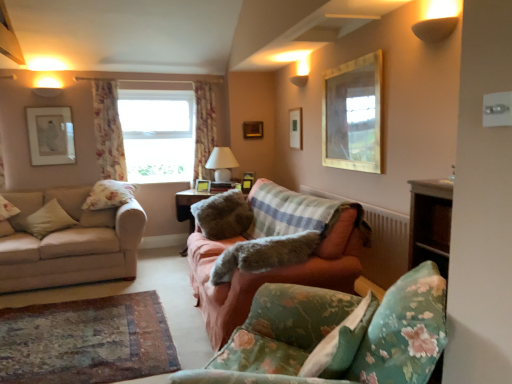
How much space does fluffy fabric pillow at center, placed as the second pillow when sorted from front to back, occupy vertically?

14.72 inches.

Where is `gold textured picture frame at upper right, which is the 6th picture frame from left to right`? Image resolution: width=512 pixels, height=384 pixels. gold textured picture frame at upper right, which is the 6th picture frame from left to right is located at coordinates (353, 115).

What do you see at coordinates (86, 341) in the screenshot? I see `rug at lower left` at bounding box center [86, 341].

Image resolution: width=512 pixels, height=384 pixels. What do you see at coordinates (51, 135) in the screenshot?
I see `matte white picture frame at upper left, which is the 6th picture frame from right to left` at bounding box center [51, 135].

Where is `beige fabric couch at left, placed as the third studio couch when sorted from right to left`? The height and width of the screenshot is (384, 512). beige fabric couch at left, placed as the third studio couch when sorted from right to left is located at coordinates (71, 243).

Is floral fabric curtain at center, which is the second curtain from front to back, smaller than gold textured picture frame at upper right, which appears as the 1th picture frame when viewed from the right?

No, floral fabric curtain at center, which is the second curtain from front to back, is not smaller than gold textured picture frame at upper right, which appears as the 1th picture frame when viewed from the right.

Based on their positions, is floral fabric curtain at center, which is counted as the first curtain, starting from the back, located to the left or right of gold textured picture frame at upper right, the 6th picture frame viewed from the back?

Based on their positions, floral fabric curtain at center, which is counted as the first curtain, starting from the back, is located to the left of gold textured picture frame at upper right, the 6th picture frame viewed from the back.

Is floral fabric curtain at center, which is the second curtain from front to back, oriented towards gold textured picture frame at upper right, which appears as the 1th picture frame when viewed from the right?

No, floral fabric curtain at center, which is the second curtain from front to back, is not aimed at gold textured picture frame at upper right, which appears as the 1th picture frame when viewed from the right.

Is floral fabric curtain at center, which is the second curtain from front to back, thinner than gold textured picture frame at upper right, which is the 6th picture frame from left to right?

No.

Would you say beige fabric couch at left, placed as the third studio couch when sorted from right to left, is inside or outside wooden picture frame at center, which appears as the 4th picture frame when viewed from the right?

beige fabric couch at left, placed as the third studio couch when sorted from right to left, exists outside the volume of wooden picture frame at center, which appears as the 4th picture frame when viewed from the right.

Looking at the image, does beige fabric couch at left, placed as the third studio couch when sorted from right to left, seem bigger or smaller compared to wooden picture frame at center, which ranks as the 4th picture frame in front-to-back order?

Considering their sizes, beige fabric couch at left, placed as the third studio couch when sorted from right to left, takes up more space than wooden picture frame at center, which ranks as the 4th picture frame in front-to-back order.

Which is more to the right, beige fabric couch at left, placed as the third studio couch when sorted from right to left, or wooden picture frame at center, which appears as the 4th picture frame when viewed from the right?

Positioned to the right is wooden picture frame at center, which appears as the 4th picture frame when viewed from the right.

Is beige fabric couch at left, placed as the third studio couch when sorted from right to left, positioned with its back to wooden picture frame at center, which is the 3th picture frame from left to right?

No, beige fabric couch at left, placed as the third studio couch when sorted from right to left, is not facing the opposite direction of wooden picture frame at center, which is the 3th picture frame from left to right.

Can you tell me how much white glossy table lamp at center and floral fabric pillow at lower right, which is the fourth pillow in back-to-front order, differ in facing direction?

96.6 degrees.

Considering the positions of points (218, 174) and (337, 343), is point (218, 174) farther from camera compared to point (337, 343)?

Yes, it is behind point (337, 343).

Is white glossy table lamp at center not within floral fabric pillow at lower right, which is the 4th pillow from left to right?

Yes, white glossy table lamp at center is outside of floral fabric pillow at lower right, which is the 4th pillow from left to right.

Is white glossy table lamp at center facing towards floral fabric pillow at lower right, which is the fourth pillow in back-to-front order?

No, white glossy table lamp at center does not turn towards floral fabric pillow at lower right, which is the fourth pillow in back-to-front order.

Is wooden picture frame at center, which appears as the 4th picture frame when viewed from the right, closer to camera compared to floral fabric sofa at lower right, arranged as the 1th studio couch when viewed from the right?

No, the depth of wooden picture frame at center, which appears as the 4th picture frame when viewed from the right, is greater than that of floral fabric sofa at lower right, arranged as the 1th studio couch when viewed from the right.

Looking at the image, does wooden picture frame at center, which is counted as the third picture frame, starting from the back, seem bigger or smaller compared to floral fabric sofa at lower right, arranged as the 1th studio couch when viewed from the right?

Considering their sizes, wooden picture frame at center, which is counted as the third picture frame, starting from the back, takes up less space than floral fabric sofa at lower right, arranged as the 1th studio couch when viewed from the right.

Are wooden picture frame at center, which appears as the 4th picture frame when viewed from the right, and floral fabric sofa at lower right, arranged as the 1th studio couch when viewed from the right, beside each other?

No, wooden picture frame at center, which appears as the 4th picture frame when viewed from the right, is not in contact with floral fabric sofa at lower right, arranged as the 1th studio couch when viewed from the right.

From the image's perspective, which is above, wooden picture frame at center, which ranks as the 4th picture frame in front-to-back order, or floral fabric sofa at lower right, marked as the 3th studio couch in a left-to-right arrangement?

wooden picture frame at center, which ranks as the 4th picture frame in front-to-back order, appears higher in the image.

From the image's perspective, is rug at lower left positioned above or below floral fabric pillow at lower right, which appears as the first pillow when viewed from the front?

rug at lower left is below floral fabric pillow at lower right, which appears as the first pillow when viewed from the front.

Is rug at lower left thinner than floral fabric pillow at lower right, which appears as the first pillow when viewed from the front?

No.

Can you confirm if rug at lower left is positioned to the left of floral fabric pillow at lower right, which appears as the first pillow when viewed from the front?

Indeed, rug at lower left is positioned on the left side of floral fabric pillow at lower right, which appears as the first pillow when viewed from the front.

Is point (12, 367) closer to camera compared to point (347, 340)?

No.

Is point (330, 249) positioned behind point (212, 98)?

That is False.

From the image's perspective, is pink fabric couch at center, which appears as the 2th studio couch when viewed from the right, positioned above or below floral fabric curtain at center, which is counted as the first curtain, starting from the back?

pink fabric couch at center, which appears as the 2th studio couch when viewed from the right, is situated lower than floral fabric curtain at center, which is counted as the first curtain, starting from the back, in the image.

Can you confirm if pink fabric couch at center, which appears as the 2th studio couch when viewed from the right, is thinner than floral fabric curtain at center, the 1th curtain in the right-to-left sequence?

No, pink fabric couch at center, which appears as the 2th studio couch when viewed from the right, is not thinner than floral fabric curtain at center, the 1th curtain in the right-to-left sequence.

Would you consider fluffy white pillow at left, marked as the 1th pillow in a back-to-front arrangement, to be distant from gold textured picture frame at upper right, which is the 6th picture frame from left to right?

Yes.

Which is closer to the camera, (95, 202) or (358, 127)?

Point (95, 202) appears to be farther away from the viewer than point (358, 127).

From the image's perspective, which pillow is the 1st one below the gold textured picture frame at upper right, which appears as the 1th picture frame when viewed from the right? Please provide its 2D coordinates.

[(109, 195)]

From a real-world perspective, count 4th picture frames upward from the floral fabric curtain at center, the 2th curtain viewed from the left, and point to it. Please provide its 2D coordinates.

[(353, 115)]

Where is `the 2nd picture frame above the beige fabric couch at left, which is the first studio couch in left-to-right order (from the image's perspective)`? The image size is (512, 384). the 2nd picture frame above the beige fabric couch at left, which is the first studio couch in left-to-right order (from the image's perspective) is located at coordinates (247, 182).

Considering their positions, is gold textured picture frame at upper right, the 6th picture frame viewed from the back, positioned further to white glossy table lamp at center than floral fabric pillow at lower right, which appears as the first pillow when viewed from the front?

floral fabric pillow at lower right, which appears as the first pillow when viewed from the front, is further to white glossy table lamp at center.

Looking at the image, which one is located further to floral fabric curtain at center, which is the second curtain from front to back, wooden picture frame at center, which appears as the sixth picture frame when viewed from the front, or white glossy table lamp at center?

Based on the image, wooden picture frame at center, which appears as the sixth picture frame when viewed from the front, appears to be further to floral fabric curtain at center, which is the second curtain from front to back.

When comparing their distances from floral fabric curtain at center, the 1th curtain in the right-to-left sequence, does beige fabric pillow at left, marked as the third pillow in a front-to-back arrangement, or floral fabric sofa at lower right, arranged as the 1th studio couch when viewed from the right, seem further?

Based on the image, floral fabric sofa at lower right, arranged as the 1th studio couch when viewed from the right, appears to be further to floral fabric curtain at center, the 1th curtain in the right-to-left sequence.

Estimate the real-world distances between objects in this image. Which object is closer to floral fabric pillow at lower right, which is the fourth pillow in back-to-front order, fluffy white pillow at left, placed as the 4th pillow when sorted from front to back, or beige fabric couch at left, placed as the third studio couch when sorted from right to left?

beige fabric couch at left, placed as the third studio couch when sorted from right to left, is closer to floral fabric pillow at lower right, which is the fourth pillow in back-to-front order.

Estimate the real-world distances between objects in this image. Which object is further from wooden picture frame at center, which appears as the sixth picture frame when viewed from the front, rug at lower left or wooden picture frame at center, positioned as the fifth picture frame in front-to-back order?

rug at lower left is positioned further to the anchor wooden picture frame at center, which appears as the sixth picture frame when viewed from the front.

When comparing their distances from floral fabric curtain at center, which is the second curtain from front to back, does rug at lower left or matte white picture frame at upper left, arranged as the 3th picture frame when viewed from the front, seem closer?

matte white picture frame at upper left, arranged as the 3th picture frame when viewed from the front.

Based on the photo, from the image, which object appears to be nearer to beige fabric pillow at left, the first pillow in the left-to-right sequence, wooden picture frame at center, which is the 5th picture frame from right to left, or wooden picture frame at upper center, the 2th picture frame in the front-to-back sequence?

wooden picture frame at center, which is the 5th picture frame from right to left, lies closer to beige fabric pillow at left, the first pillow in the left-to-right sequence, than the other object.

Which object lies further to the anchor point rug at lower left, fluffy fabric pillow at center, placed as the second pillow when sorted from front to back, or beige fabric pillow at left, marked as the third pillow in a front-to-back arrangement?

beige fabric pillow at left, marked as the third pillow in a front-to-back arrangement, is positioned further to the anchor rug at lower left.

Where is `table lamp between beige fabric couch at left, placed as the third studio couch when sorted from right to left, and wooden picture frame at center, which is counted as the third picture frame, starting from the back, from left to right`? The width and height of the screenshot is (512, 384). table lamp between beige fabric couch at left, placed as the third studio couch when sorted from right to left, and wooden picture frame at center, which is counted as the third picture frame, starting from the back, from left to right is located at coordinates (222, 163).

This screenshot has width=512, height=384. I want to click on table lamp between fluffy fabric pillow at center, placed as the second pillow when sorted from front to back, and wooden picture frame at center, which ranks as the 4th picture frame in front-to-back order, along the z-axis, so click(222, 163).

Find the location of a particular element. Image resolution: width=512 pixels, height=384 pixels. studio couch between pink fabric couch at center, which appears as the 2th studio couch when viewed from the right, and wooden picture frame at center, which is the 2th picture frame in left-to-right order, from front to back is located at coordinates pos(71,243).

Where is `picture frame between matte white picture frame at upper left, arranged as the 3th picture frame when viewed from the front, and white glossy table lamp at center`? picture frame between matte white picture frame at upper left, arranged as the 3th picture frame when viewed from the front, and white glossy table lamp at center is located at coordinates (x=202, y=185).